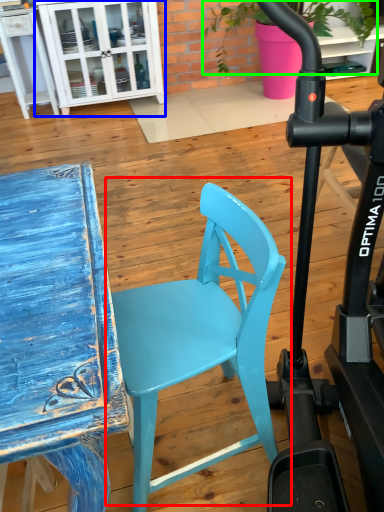
Question: Which object is positioned farthest from chair (highlighted by a red box)? Select from cabinetry (highlighted by a blue box) and plant (highlighted by a green box).

Choices:
 (A) cabinetry
 (B) plant

Answer: (B)